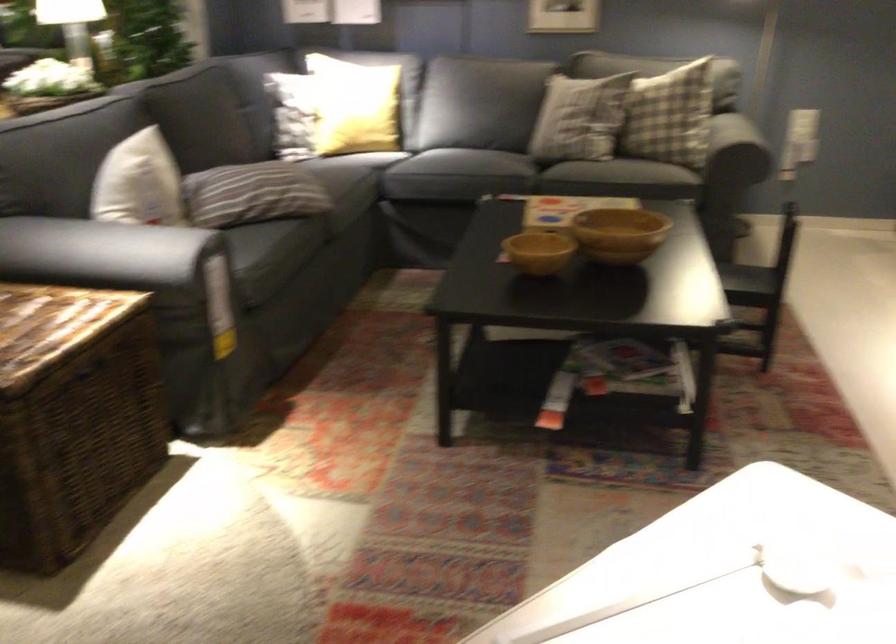
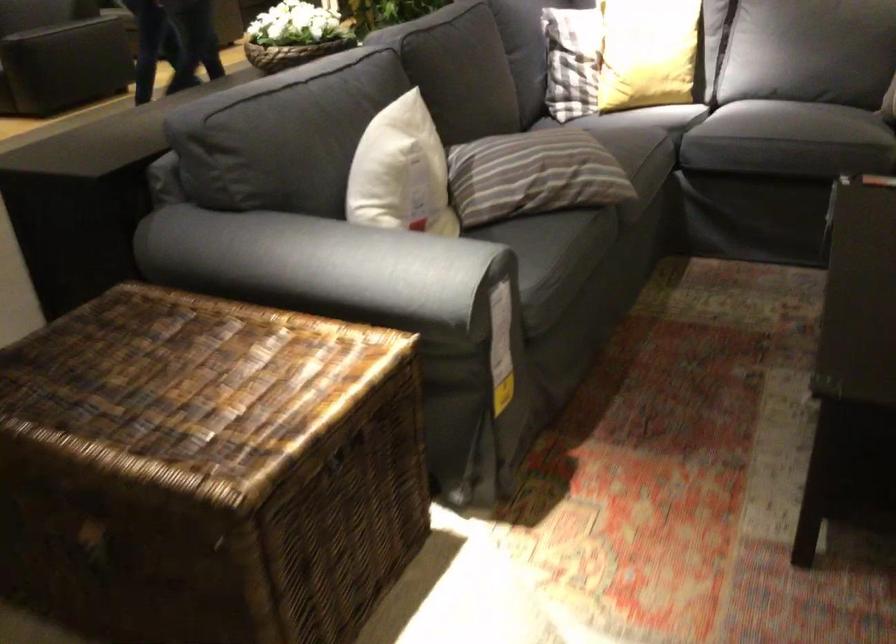
Question: The first image is from the beginning of the video and the second image is from the end. How did the camera likely rotate when shooting the video?

Choices:
 (A) Left
 (B) Right
 (C) Up
 (D) Down

Answer: (A)